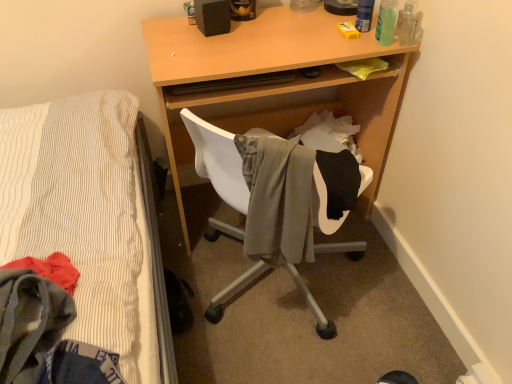
Question: Is gray fabric chair at center aimed at green translucent bottle at upper right, which is the second bottle from left to right?

Choices:
 (A) yes
 (B) no

Answer: (A)

Question: Is gray fabric chair at center positioned with its back to green translucent bottle at upper right, which is the second bottle from left to right?

Choices:
 (A) no
 (B) yes

Answer: (A)

Question: Is there a large distance between gray fabric chair at center and green translucent bottle at upper right, arranged as the 2th bottle when viewed from the right?

Choices:
 (A) no
 (B) yes

Answer: (A)

Question: Is gray fabric chair at center located outside green translucent bottle at upper right, which is the second bottle from left to right?

Choices:
 (A) yes
 (B) no

Answer: (A)

Question: From a real-world perspective, is gray fabric chair at center beneath green translucent bottle at upper right, which is the second bottle from left to right?

Choices:
 (A) no
 (B) yes

Answer: (B)

Question: In the image, is light wood desk at center positioned in front of or behind translucent plastic bottle at upper right, marked as the 1th bottle in a left-to-right arrangement?

Choices:
 (A) behind
 (B) front

Answer: (B)

Question: Does point (287, 61) appear closer or farther from the camera than point (370, 9)?

Choices:
 (A) farther
 (B) closer

Answer: (B)

Question: Visually, is light wood desk at center positioned to the left or to the right of translucent plastic bottle at upper right, the 3th bottle positioned from the right?

Choices:
 (A) left
 (B) right

Answer: (A)

Question: Considering the positions of light wood desk at center and translucent plastic bottle at upper right, marked as the 1th bottle in a left-to-right arrangement, in the image, is light wood desk at center taller or shorter than translucent plastic bottle at upper right, marked as the 1th bottle in a left-to-right arrangement,?

Choices:
 (A) tall
 (B) short

Answer: (A)

Question: From the image's perspective, is translucent plastic bottle at upper right, marked as the 1th bottle in a left-to-right arrangement, located above or below gray fabric chair at center?

Choices:
 (A) above
 (B) below

Answer: (A)

Question: From a real-world perspective, is translucent plastic bottle at upper right, marked as the 1th bottle in a left-to-right arrangement, physically located above or below gray fabric chair at center?

Choices:
 (A) below
 (B) above

Answer: (B)

Question: In terms of width, does translucent plastic bottle at upper right, marked as the 1th bottle in a left-to-right arrangement, look wider or thinner when compared to gray fabric chair at center?

Choices:
 (A) thin
 (B) wide

Answer: (A)

Question: Based on their sizes in the image, would you say translucent plastic bottle at upper right, the 3th bottle positioned from the right, is bigger or smaller than gray fabric chair at center?

Choices:
 (A) big
 (B) small

Answer: (B)

Question: In terms of width, does green translucent bottle at upper right, which is the second bottle from left to right, look wider or thinner when compared to translucent plastic bottle at upper right, the 3th bottle positioned from the right?

Choices:
 (A) thin
 (B) wide

Answer: (B)

Question: From their relative heights in the image, would you say green translucent bottle at upper right, arranged as the 2th bottle when viewed from the right, is taller or shorter than translucent plastic bottle at upper right, the 3th bottle positioned from the right?

Choices:
 (A) tall
 (B) short

Answer: (B)